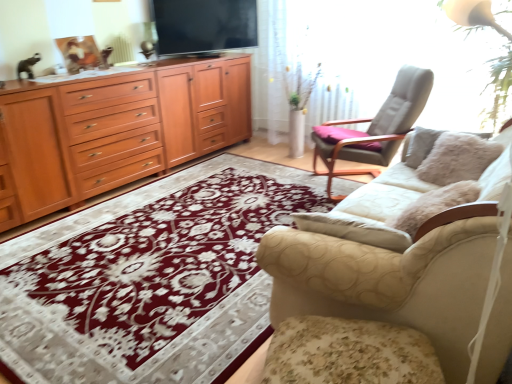
Question: Can you confirm if wooden cabinet at left is shorter than beige fabric couch at right?

Choices:
 (A) no
 (B) yes

Answer: (B)

Question: From a real-world perspective, does wooden cabinet at left sit lower than beige fabric couch at right?

Choices:
 (A) yes
 (B) no

Answer: (B)

Question: Is beige fabric couch at right at the back of wooden cabinet at left?

Choices:
 (A) yes
 (B) no

Answer: (B)

Question: Is wooden cabinet at left taller than beige fabric couch at right?

Choices:
 (A) yes
 (B) no

Answer: (B)

Question: From the image's perspective, is wooden cabinet at left on top of beige fabric couch at right?

Choices:
 (A) no
 (B) yes

Answer: (B)

Question: Based on their sizes in the image, would you say light gray fabric chair at upper right is bigger or smaller than floral fabric footrest at lower right?

Choices:
 (A) small
 (B) big

Answer: (B)

Question: From a real-world perspective, relative to floral fabric footrest at lower right, is light gray fabric chair at upper right vertically above or below?

Choices:
 (A) below
 (B) above

Answer: (B)

Question: From the image's perspective, is light gray fabric chair at upper right located above or below floral fabric footrest at lower right?

Choices:
 (A) above
 (B) below

Answer: (A)

Question: In the image, is light gray fabric chair at upper right positioned in front of or behind floral fabric footrest at lower right?

Choices:
 (A) behind
 (B) front

Answer: (A)

Question: Is light gray fabric chair at upper right in front of or behind wooden cabinet at left in the image?

Choices:
 (A) front
 (B) behind

Answer: (A)

Question: In the image, is light gray fabric chair at upper right on the left side or the right side of wooden cabinet at left?

Choices:
 (A) left
 (B) right

Answer: (B)

Question: From a real-world perspective, relative to wooden cabinet at left, is light gray fabric chair at upper right vertically above or below?

Choices:
 (A) above
 (B) below

Answer: (B)

Question: Which is correct: light gray fabric chair at upper right is inside wooden cabinet at left, or outside of it?

Choices:
 (A) outside
 (B) inside

Answer: (A)

Question: Does point (124, 130) appear closer or farther from the camera than point (412, 110)?

Choices:
 (A) farther
 (B) closer

Answer: (A)

Question: From a real-world perspective, is wooden drawer at left above or below light gray fabric chair at upper right?

Choices:
 (A) above
 (B) below

Answer: (A)